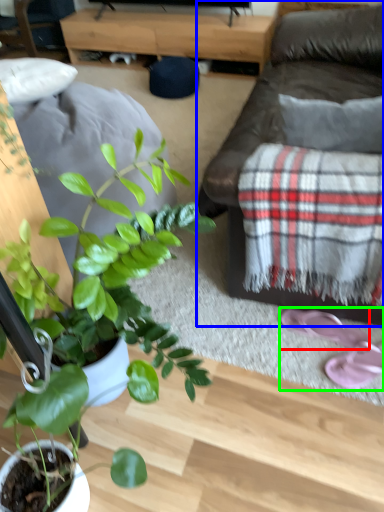
Question: Estimate the real-world distances between objects in this image. Which object is closer to footwear (highlighted by a red box), studio couch (highlighted by a blue box) or footwear (highlighted by a green box)?

Choices:
 (A) studio couch
 (B) footwear

Answer: (B)